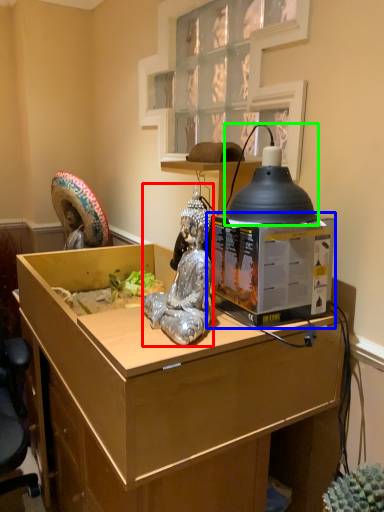
Question: Considering the real-world distances, which object is closest to person (highlighted by a red box)? desktop computer (highlighted by a blue box) or lamp (highlighted by a green box).

Choices:
 (A) desktop computer
 (B) lamp

Answer: (A)